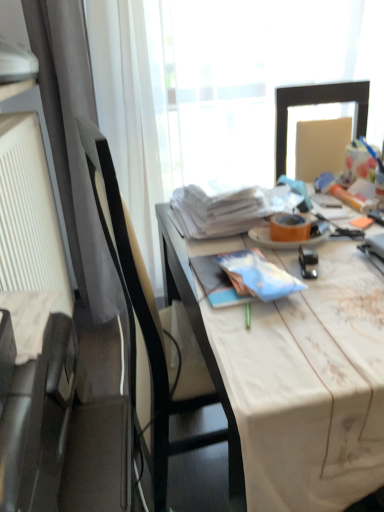
Question: Is black leather chair at left surrounded by white fabric-covered desk at center?

Choices:
 (A) no
 (B) yes

Answer: (B)

Question: Does white fabric-covered desk at center have a greater width compared to black leather chair at left?

Choices:
 (A) yes
 (B) no

Answer: (A)

Question: Is white fabric-covered desk at center positioned behind black leather chair at left?

Choices:
 (A) no
 (B) yes

Answer: (A)

Question: Is white fabric-covered desk at center at the right side of black leather chair at left?

Choices:
 (A) no
 (B) yes

Answer: (B)

Question: Is the surface of white fabric-covered desk at center in direct contact with black leather chair at left?

Choices:
 (A) no
 (B) yes

Answer: (A)

Question: Looking at the image, does orange matte plate at center seem bigger or smaller compared to black leather chair at left?

Choices:
 (A) small
 (B) big

Answer: (A)

Question: Is orange matte plate at center wider or thinner than black leather chair at left?

Choices:
 (A) thin
 (B) wide

Answer: (A)

Question: From the image's perspective, is orange matte plate at center positioned above or below black leather chair at left?

Choices:
 (A) below
 (B) above

Answer: (B)

Question: Does point (317, 233) appear closer or farther from the camera than point (236, 480)?

Choices:
 (A) farther
 (B) closer

Answer: (A)

Question: Visually, is white textured radiator at left positioned to the left or to the right of black leather chair at left?

Choices:
 (A) right
 (B) left

Answer: (B)

Question: Looking at their shapes, would you say white textured radiator at left is wider or thinner than black leather chair at left?

Choices:
 (A) wide
 (B) thin

Answer: (B)

Question: In terms of height, does white textured radiator at left look taller or shorter compared to black leather chair at left?

Choices:
 (A) short
 (B) tall

Answer: (A)

Question: From the image's perspective, is white textured radiator at left above or below black leather chair at left?

Choices:
 (A) below
 (B) above

Answer: (B)

Question: Does point (372, 309) appear closer or farther from the camera than point (322, 233)?

Choices:
 (A) farther
 (B) closer

Answer: (B)

Question: In terms of width, does white fabric-covered desk at center look wider or thinner when compared to orange matte plate at center?

Choices:
 (A) thin
 (B) wide

Answer: (B)